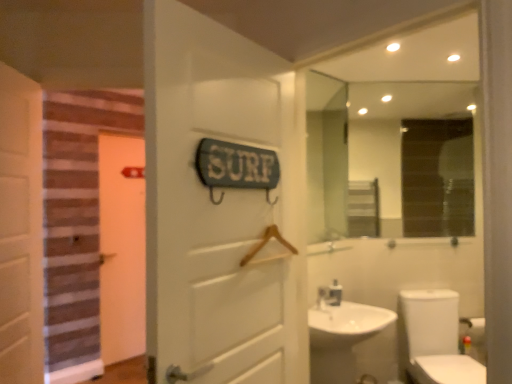
Question: Can you confirm if white glossy faucet at sink right is positioned to the left of white matte door at center, the 3th door viewed from the left?

Choices:
 (A) yes
 (B) no

Answer: (B)

Question: Considering the relative sizes of white glossy faucet at sink right and white matte door at center, the first door in the right-to-left sequence, in the image provided, is white glossy faucet at sink right taller than white matte door at center, the first door in the right-to-left sequence,?

Choices:
 (A) no
 (B) yes

Answer: (A)

Question: Does white glossy faucet at sink right lie behind white matte door at center, the first door in the right-to-left sequence?

Choices:
 (A) yes
 (B) no

Answer: (A)

Question: Does white glossy faucet at sink right have a smaller size compared to white matte door at center, the first door in the right-to-left sequence?

Choices:
 (A) yes
 (B) no

Answer: (A)

Question: Is white glossy faucet at sink right not near white matte door at center, which is counted as the first door, starting from the front?

Choices:
 (A) yes
 (B) no

Answer: (A)

Question: Is white glossy faucet at sink right in contact with white matte door at center, which is counted as the first door, starting from the front?

Choices:
 (A) yes
 (B) no

Answer: (B)

Question: From a real-world perspective, is white matte door at center, the first door in the right-to-left sequence, physically above white wooden door at left, which ranks as the second door in right-to-left order?

Choices:
 (A) no
 (B) yes

Answer: (B)

Question: Does white matte door at center, which is counted as the first door, starting from the front, lie in front of white wooden door at left, the 2th door from the back?

Choices:
 (A) yes
 (B) no

Answer: (A)

Question: Is white matte door at center, which is counted as the first door, starting from the front, looking in the opposite direction of white wooden door at left, the 2th door from the back?

Choices:
 (A) yes
 (B) no

Answer: (A)

Question: Can you confirm if white matte door at center, the 3th door viewed from the left, is positioned to the left of white wooden door at left, the 2th door viewed from the left?

Choices:
 (A) yes
 (B) no

Answer: (B)

Question: Can you confirm if white matte door at center, the 3th door viewed from the left, is bigger than white wooden door at left, which appears as the 2th door when viewed from the front?

Choices:
 (A) yes
 (B) no

Answer: (A)

Question: Does white matte door at center, the first door in the right-to-left sequence, appear on the right side of white wooden door at left, which ranks as the second door in right-to-left order?

Choices:
 (A) yes
 (B) no

Answer: (A)

Question: Considering the relative positions of orange matte door at left, the 3th door positioned from the front, and white glossy faucet at sink right in the image provided, is orange matte door at left, the 3th door positioned from the front, to the right of white glossy faucet at sink right from the viewer's perspective?

Choices:
 (A) no
 (B) yes

Answer: (A)